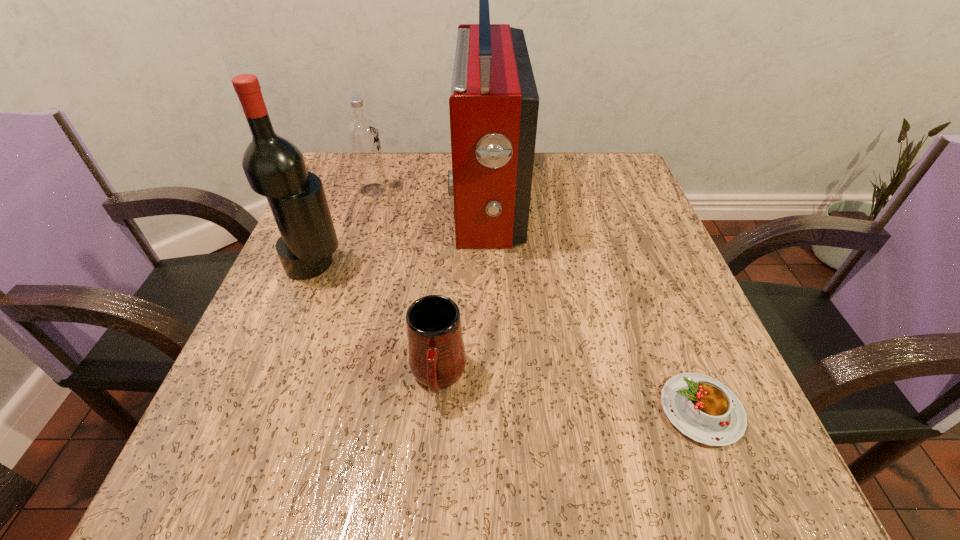
You are a GUI agent. You are given a task and a screenshot of the screen. Output one action in this format:
    pyautogui.click(x=<x>, y=<y>)
    Task: Click on the radio receiver
    This screenshot has width=960, height=540.
    Given the screenshot: What is the action you would take?
    pyautogui.click(x=493, y=105)

Where is `wine bottle`? This screenshot has width=960, height=540. wine bottle is located at coordinates (274, 167).

Where is `the third shortest object`? This screenshot has height=540, width=960. the third shortest object is located at coordinates 362,134.

You are a GUI agent. You are given a task and a screenshot of the screen. Output one action in this format:
    pyautogui.click(x=<x>, y=<y>)
    Task: Click on the second shortest object
    
    Given the screenshot: What is the action you would take?
    [437, 358]

This screenshot has height=540, width=960. I want to click on the shortest object, so click(x=702, y=408).

You are a GUI agent. You are given a task and a screenshot of the screen. Output one action in this format:
    pyautogui.click(x=<x>, y=<y>)
    Task: Click on the pudding
    
    Given the screenshot: What is the action you would take?
    pyautogui.click(x=702, y=408)

At what (x,y) coordinates should I click in order to perform the action: click on free space located 0.080m on the front-facing side of the radio receiver. Please return your answer as a coordinate pair (x, y). This screenshot has height=540, width=960. Looking at the image, I should click on (419, 197).

This screenshot has width=960, height=540. I want to click on vacant region located 0.290m on the front-facing side of the radio receiver, so click(326, 197).

The height and width of the screenshot is (540, 960). In order to click on free space located 0.100m on the front-facing side of the radio receiver in this screenshot , I will do `click(410, 197)`.

I want to click on free location located 0.190m on the back of the wine bottle, so click(342, 195).